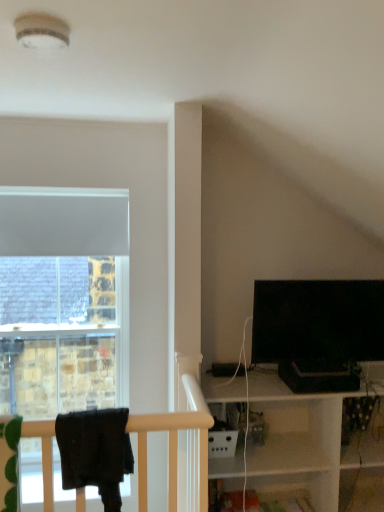
Question: Based on their sizes in the image, would you say black glossy tv at right is bigger or smaller than black fabric at left?

Choices:
 (A) small
 (B) big

Answer: (B)

Question: In terms of width, does black glossy tv at right look wider or thinner when compared to black fabric at left?

Choices:
 (A) thin
 (B) wide

Answer: (A)

Question: From a real-world perspective, relative to black fabric at left, is black glossy tv at right vertically above or below?

Choices:
 (A) above
 (B) below

Answer: (A)

Question: Is black fabric at left to the left or to the right of black glossy tv at right in the image?

Choices:
 (A) right
 (B) left

Answer: (B)

Question: Is black fabric at left bigger or smaller than black glossy tv at right?

Choices:
 (A) big
 (B) small

Answer: (B)

Question: Is black fabric at left inside the boundaries of black glossy tv at right, or outside?

Choices:
 (A) inside
 (B) outside

Answer: (B)

Question: From the image's perspective, is black fabric at left located above or below black glossy tv at right?

Choices:
 (A) above
 (B) below

Answer: (B)